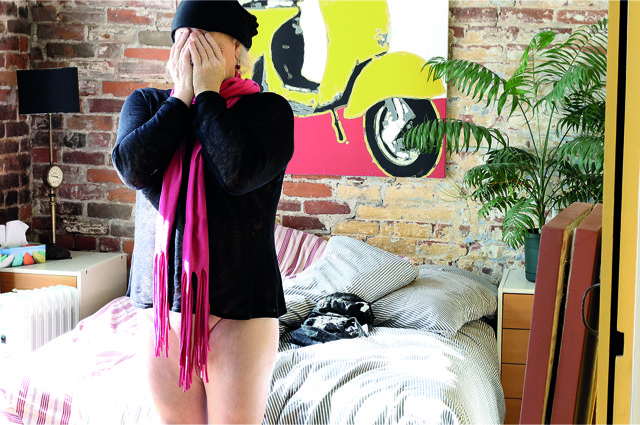
Identify the location of black lampshade. This screenshot has height=425, width=640. (44, 86).